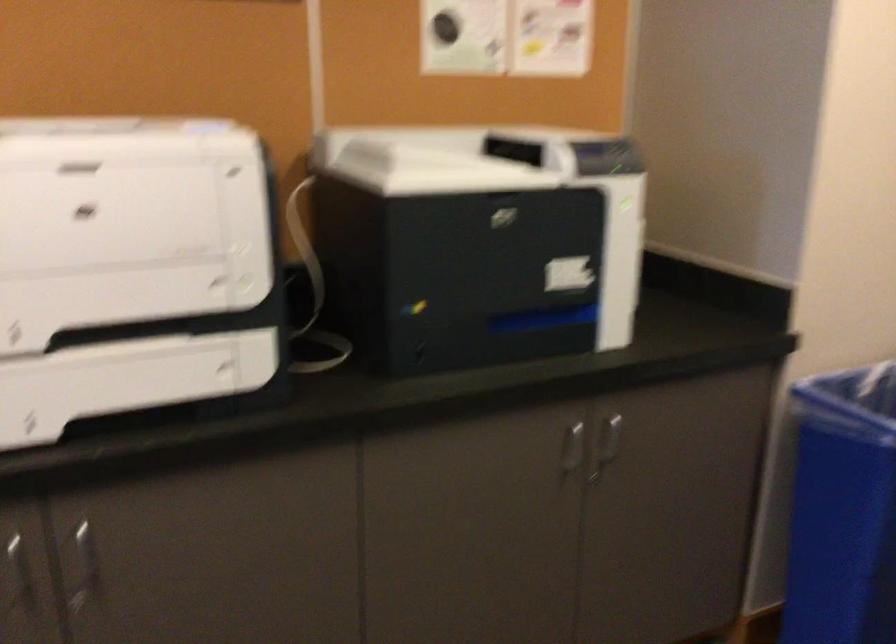
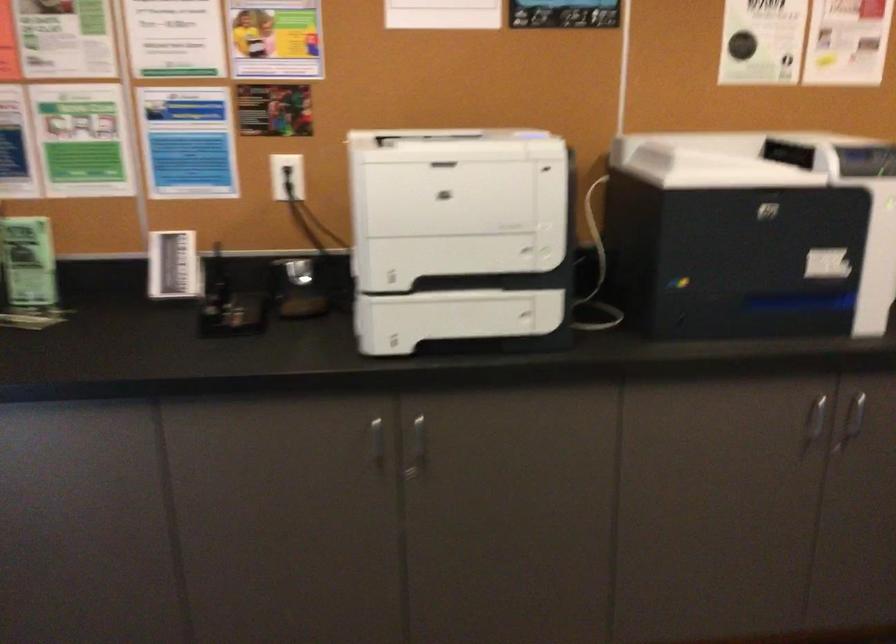
Find the pixel in the second image that matches point 478,278 in the first image.

(737, 259)